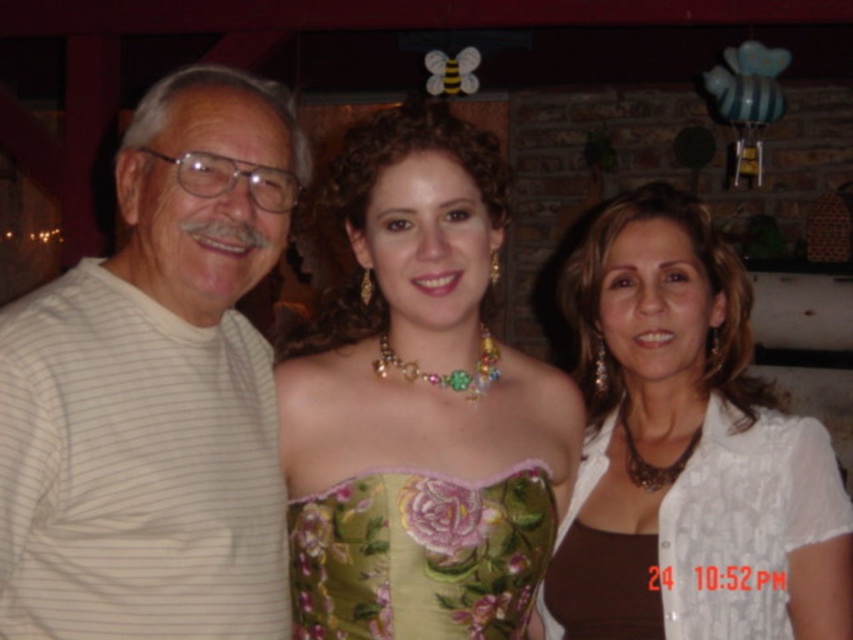
You are a photographer trying to adjust the lighting for a group photo. You notice the green floral dress at center and the white lace blouse at center. Which clothing item requires more space to avoid overcrowding in the frame?

The green floral dress at center requires more space because its width is larger than the white lace blouse at center, so it would need more room to prevent overcrowding in the frame.

You are a photographer trying to adjust the lighting for a group photo. The green floral dress at center and the white lace blouse at center are both in the frame. Which clothing item requires more space in the frame to accommodate its size?

The green floral dress at center is bigger than the white lace blouse at center, so it requires more space in the frame to accommodate its size.